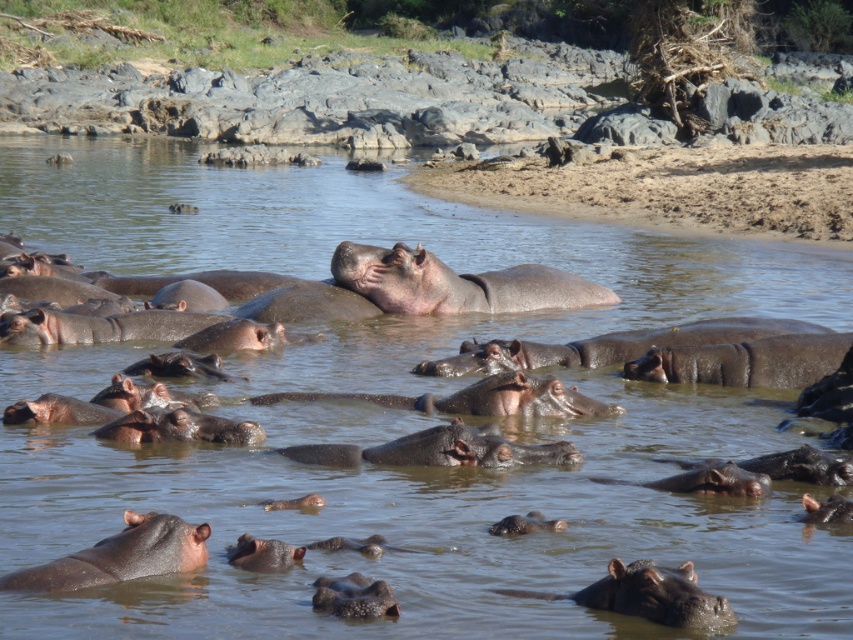
From the picture: Is gray matte hippo at center in front of gray textured hippo at center?

That is False.

Can you confirm if gray matte hippo at center is positioned to the left of gray textured hippo at center?

No, gray matte hippo at center is not to the left of gray textured hippo at center.

Does point (439, 278) come farther from viewer compared to point (358, 588)?

Yes, point (439, 278) is farther from viewer.

This screenshot has width=853, height=640. I want to click on gray matte hippo at center, so click(456, 284).

Which of these two, dark brown skin at lower left or dark brown skin at center, stands taller?

dark brown skin at lower left

Does dark brown skin at lower left have a greater width compared to dark brown skin at center?

Indeed, dark brown skin at lower left has a greater width compared to dark brown skin at center.

The width and height of the screenshot is (853, 640). What do you see at coordinates (120, 556) in the screenshot?
I see `dark brown skin at lower left` at bounding box center [120, 556].

In order to click on dark brown skin at lower left in this screenshot , I will do `click(120, 556)`.

Who is taller, grayish-brown skin hippo at center-right or dark brown skin at center?

Standing taller between the two is grayish-brown skin hippo at center-right.

Between point (648, 358) and point (258, 547), which one is positioned in front?

Point (258, 547) is in front.

Find the location of `grayish-brown skin hippo at center-right`. grayish-brown skin hippo at center-right is located at coordinates (746, 362).